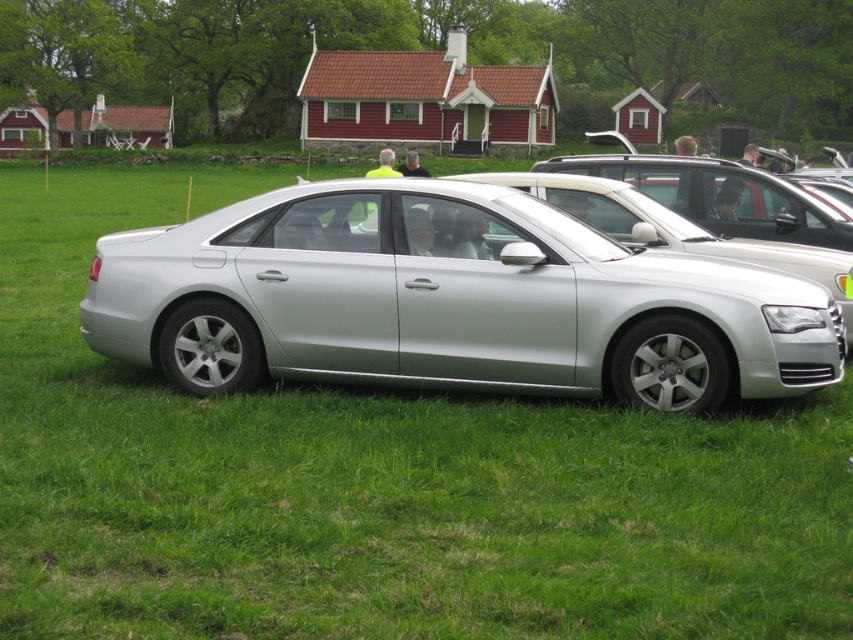
Question: Is silver metallic sedan at center smaller than satin silver car at center?

Choices:
 (A) yes
 (B) no

Answer: (B)

Question: Can you confirm if silver metallic sedan at center is positioned to the right of satin silver car at center?

Choices:
 (A) yes
 (B) no

Answer: (B)

Question: Which of the following is the closest to the observer?

Choices:
 (A) silver metallic sedan at center
 (B) satin silver car at center

Answer: (A)

Question: Which object is closer to the camera taking this photo?

Choices:
 (A) silver metallic sedan at center
 (B) satin silver car at center

Answer: (A)

Question: Does silver metallic sedan at center have a larger size compared to satin silver car at center?

Choices:
 (A) yes
 (B) no

Answer: (A)

Question: Which point is closer to the camera?

Choices:
 (A) (380, 276)
 (B) (531, 189)

Answer: (A)